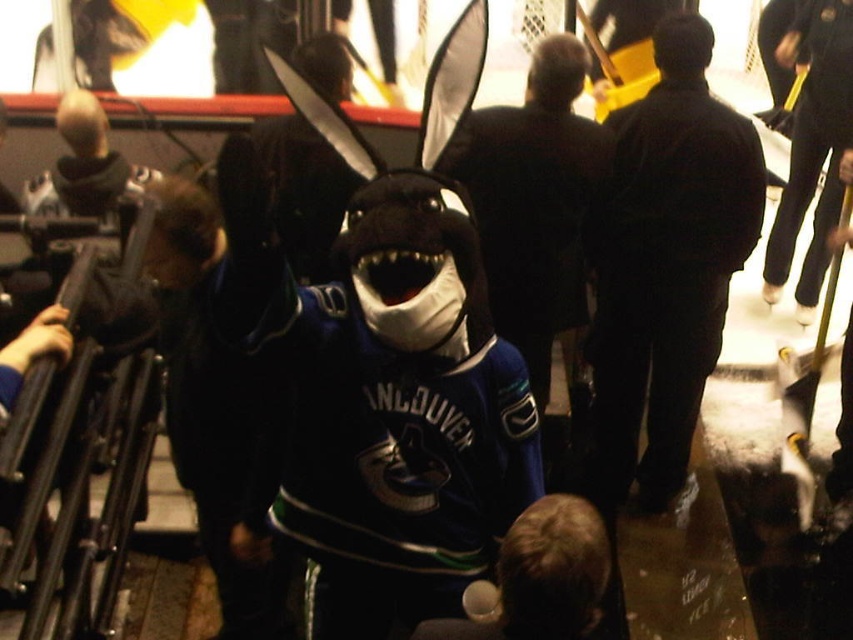
Question: Estimate the real-world distances between objects in this image. Which object is farther from the velvet plush shark at center?

Choices:
 (A) black matte jacket at center
 (B) dark blue jacket at center

Answer: (B)

Question: Which point appears closest to the camera in this image?

Choices:
 (A) (247, 150)
 (B) (618, 449)
 (C) (515, 148)

Answer: (A)

Question: Among these objects, which one is nearest to the camera?

Choices:
 (A) velvet plush shark at center
 (B) black matte jacket at center
 (C) dark blue jacket at center

Answer: (A)

Question: Does velvet plush shark at center appear on the left side of black matte jacket at center?

Choices:
 (A) no
 (B) yes

Answer: (B)

Question: Is velvet plush shark at center bigger than black matte jacket at center?

Choices:
 (A) no
 (B) yes

Answer: (B)

Question: Can you confirm if velvet plush shark at center is thinner than dark blue jacket at center?

Choices:
 (A) no
 (B) yes

Answer: (A)